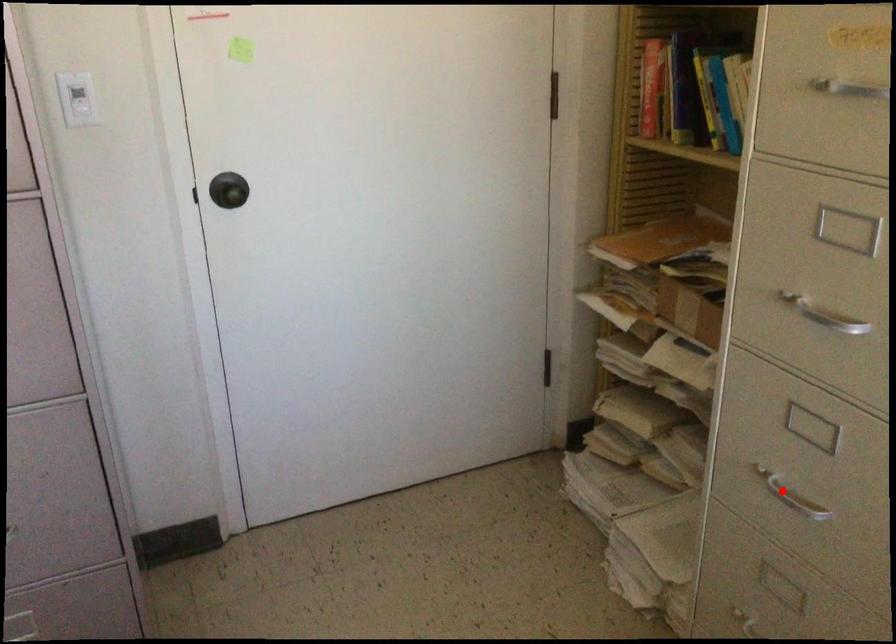
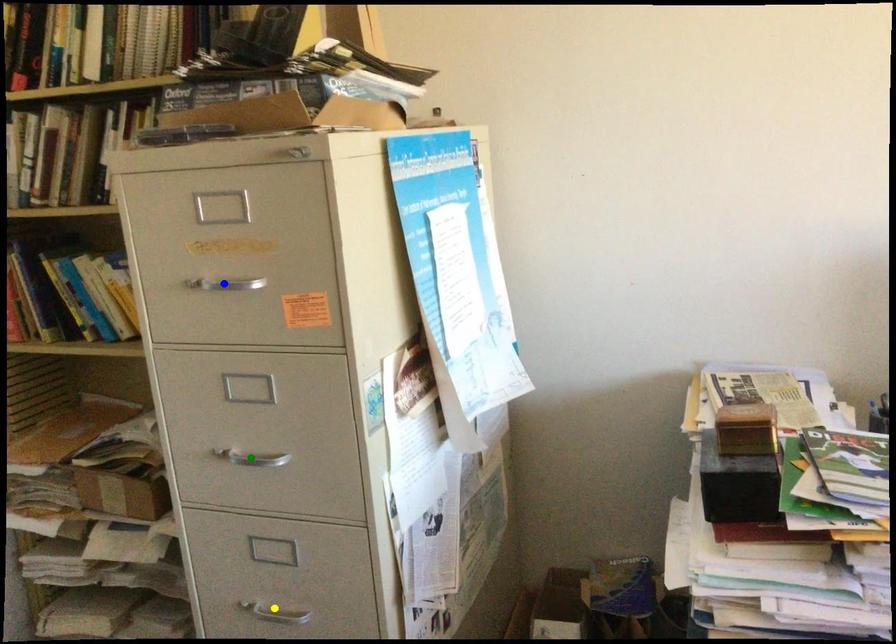
Question: I am providing you with two images of the same scene from different viewpoints. A red point is marked on the first image. You are given multiple points on the second image. Which point in image 2 is actually the same real-world point as the red point in image 1?

Choices:
 (A) green point
 (B) blue point
 (C) yellow point

Answer: (C)